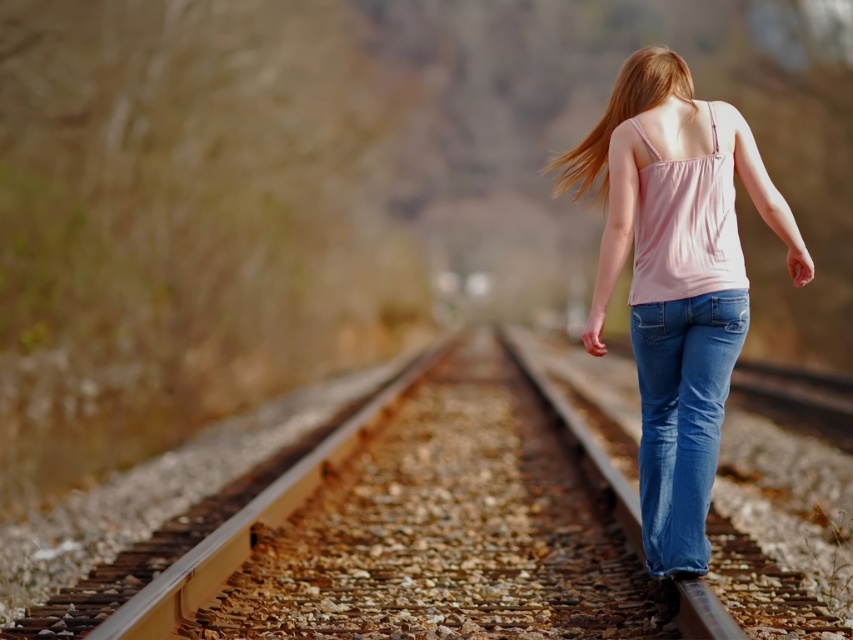
You are a photographer trying to capture the person walking along the railway tracks. You notice the blue denim jeans at center and the blonde silky hair at center in your viewfinder. Which object appears narrower in your current camera frame?

The blue denim jeans at center appears narrower than the blonde silky hair at center in the viewfinder.